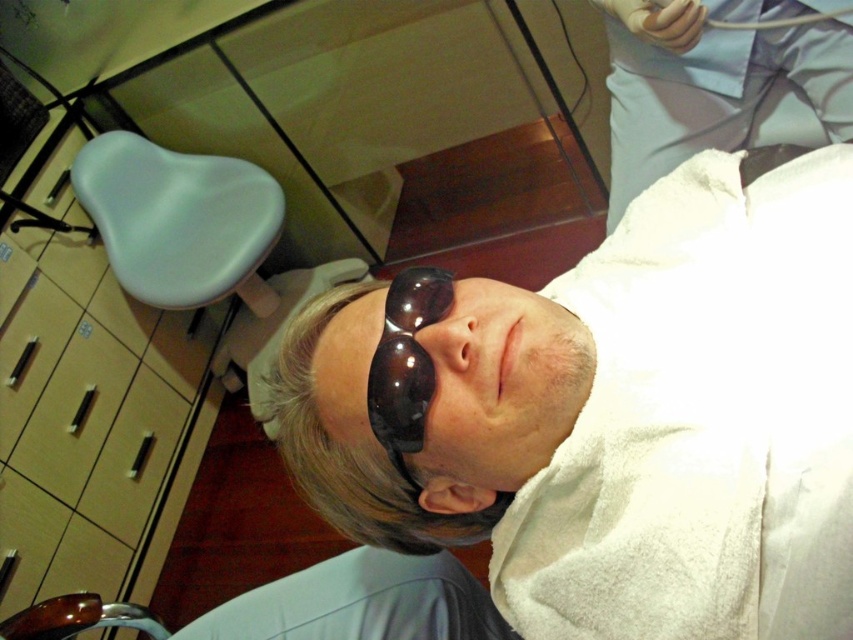
You are a dental assistant entering the clinic and need to retrieve the white cloth at upper right and dark matte glasses at center. Which object should you reach for first if you want to grab the one closer to your current position?

The dark matte glasses at center are closer to your current position than the white cloth at upper right, so you should reach for the dark matte glasses at center first.

Based on the photo, you are a dental assistant entering the clinic and need to place the dark matte glasses at center on the light blue plastic chair at left. Can you confirm if the chair has enough space to accommodate the glasses?

The light blue plastic chair at left is larger in size than dark matte glasses at center, so yes, the chair has enough space to accommodate the glasses.

You are a dental assistant who needs to move the light blue plastic chair at left closer to the white cloth at upper right. How much distance do you need to move it to make them touch?

The white cloth at upper right and light blue plastic chair at left are 3.86 feet apart. To make them touch, move the light blue plastic chair at left 3.86 feet toward the white cloth at upper right.